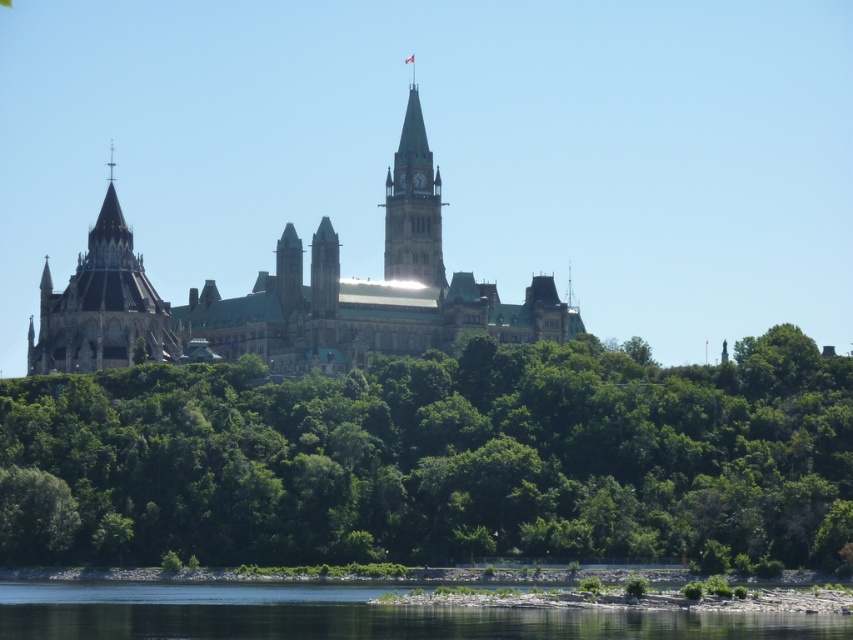
The image size is (853, 640). In order to click on green leafy trees at center in this screenshot , I will do `click(442, 458)`.

Locate an element on the screen. green leafy trees at center is located at coordinates (442, 458).

Is green leafy trees at center to the right of green slate roof at center from the viewer's perspective?

Indeed, green leafy trees at center is positioned on the right side of green slate roof at center.

Is point (450, 552) more distant than point (254, 337)?

No, it is not.

At what (x,y) coordinates should I click in order to perform the action: click on green leafy trees at center. Please return your answer as a coordinate pair (x, y). This screenshot has height=640, width=853. Looking at the image, I should click on (442, 458).

Can you confirm if green slate roof at center is taller than green stone clock tower at center?

Yes, green slate roof at center is taller than green stone clock tower at center.

Between green slate roof at center and green stone clock tower at center, which one has more height?

green slate roof at center

Does point (442, 330) come farther from viewer compared to point (418, 228)?

That is False.

Where is `green slate roof at center`? The height and width of the screenshot is (640, 853). green slate roof at center is located at coordinates (293, 294).